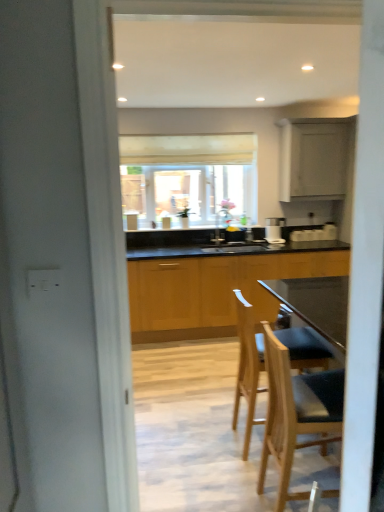
Question: Considering the relative positions of matte wood cabinet at upper right, which is the 1th cabinetry in top-to-bottom order, and matte white window at center in the image provided, is matte wood cabinet at upper right, which is the 1th cabinetry in top-to-bottom order, to the left or to the right of matte white window at center?

Choices:
 (A) left
 (B) right

Answer: (B)

Question: From the image's perspective, is matte wood cabinet at upper right, placed as the 2th cabinetry when sorted from bottom to top, positioned above or below matte white window at center?

Choices:
 (A) below
 (B) above

Answer: (B)

Question: Based on their relative distances, which object is farther from the satin silver coffee machine at center?

Choices:
 (A) matte wood cabinet at upper right, which is the 1th cabinetry in top-to-bottom order
 (B) wooden cabinets at center, which is the 2th cabinetry in top-to-bottom order
 (C) matte white window at center
 (D) wooden bar stool at center, the 1th chair in the front-to-back sequence
 (E) light wood bar stool at center, which is the first chair in back-to-front order

Answer: (D)

Question: Estimate the real-world distances between objects in this image. Which object is closer to the satin silver coffee machine at center?

Choices:
 (A) wooden cabinets at center, arranged as the first cabinetry when ordered from the bottom
 (B) matte wood cabinet at upper right, placed as the 2th cabinetry when sorted from bottom to top
 (C) light wood bar stool at center, which is counted as the second chair, starting from the front
 (D) wooden bar stool at center, the 1th chair in the front-to-back sequence
 (E) matte white window at center

Answer: (B)